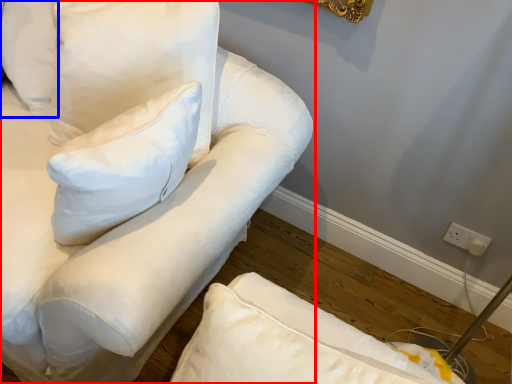
Question: Among these objects, which one is farthest to the camera, furniture (highlighted by a red box) or pillow (highlighted by a blue box)?

Choices:
 (A) furniture
 (B) pillow

Answer: (B)